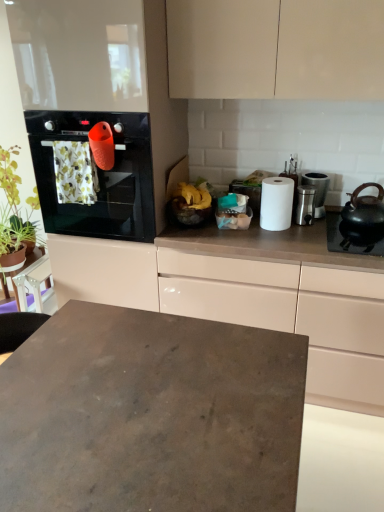
Question: Visually, is satin silver canister at right, which is the 1th appliance from right to left, positioned to the left or to the right of black matte gas stove at right?

Choices:
 (A) left
 (B) right

Answer: (A)

Question: Is satin silver canister at right, which is the 1th appliance from right to left, taller or shorter than black matte gas stove at right?

Choices:
 (A) short
 (B) tall

Answer: (B)

Question: Estimate the real-world distances between objects in this image. Which object is closer to the black matte gas stove at right?

Choices:
 (A) white matte paper towel at center
 (B) white glossy cabinet at upper right
 (C) yellow matte bananas at center
 (D) satin silver canister at right, the 2th appliance when ordered from left to right
 (E) matte concrete desk at center

Answer: (D)

Question: Which is farther from the satin silver canister at center right, marked as the first appliance in a left-to-right arrangement?

Choices:
 (A) yellow matte bananas at center
 (B) black glass oven at left
 (C) white glossy cabinet at upper right
 (D) green leafy plant at left
 (E) white matte paper towel at center

Answer: (D)